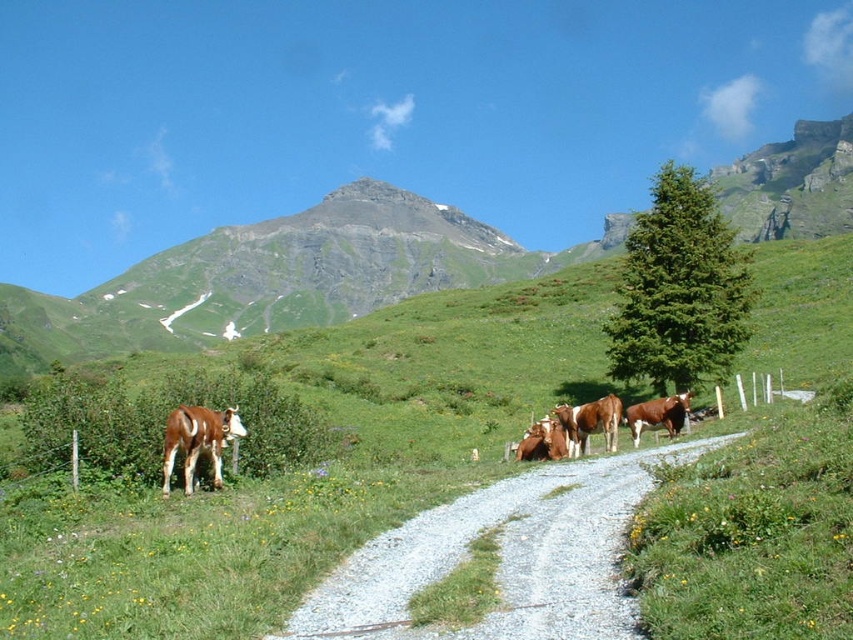
You are a hiker standing at the starting point of the gravel path. You want to reach the green grassy mountain at upper center. If your average walking speed is 3.5 km per hour, how long would it take you to reach the mountain?

The green grassy mountain at upper center is 66.87 meters away from camera. At an average walking speed of 3.5 km per hour, it would take approximately 1.2 minutes to reach the mountain.

You are a hiker standing at the starting point of the gravel path in the meadow. You want to reach the green grassy mountain at upper center. Which direction should you head towards?

The green grassy mountain at upper center is located at point coordinates of (279, 276), so you should head towards the upper center direction to reach it.